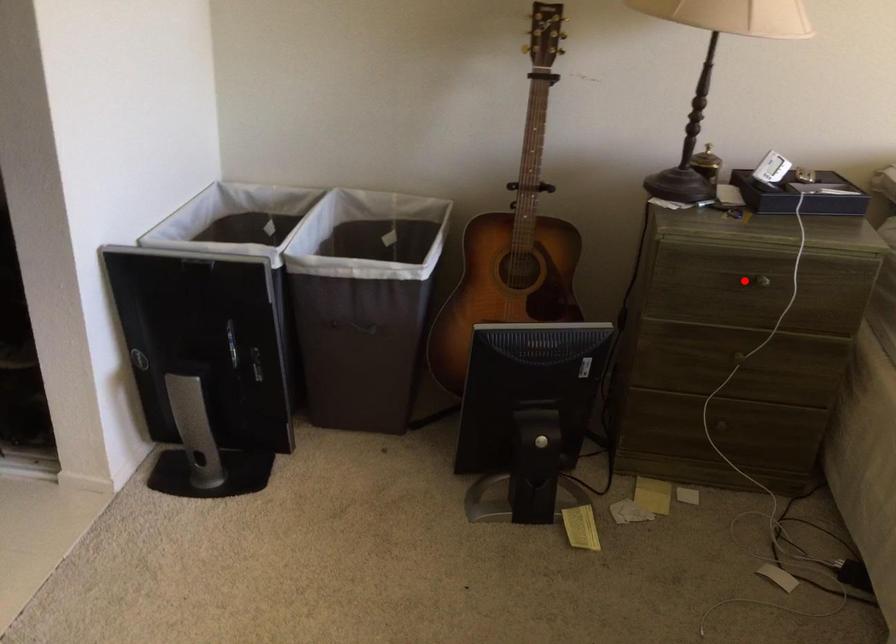
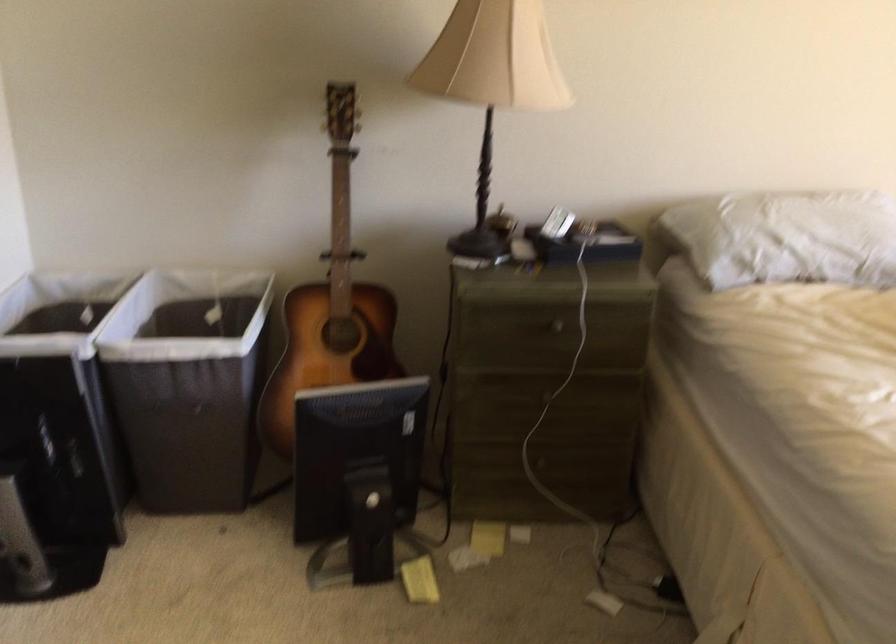
Question: I am providing you with two images of the same scene from different viewpoints. Given a red point in image1, look at the same physical point in image2. Is it:

Choices:
 (A) Closer to the viewpoint
 (B) Farther from the viewpoint

Answer: (B)